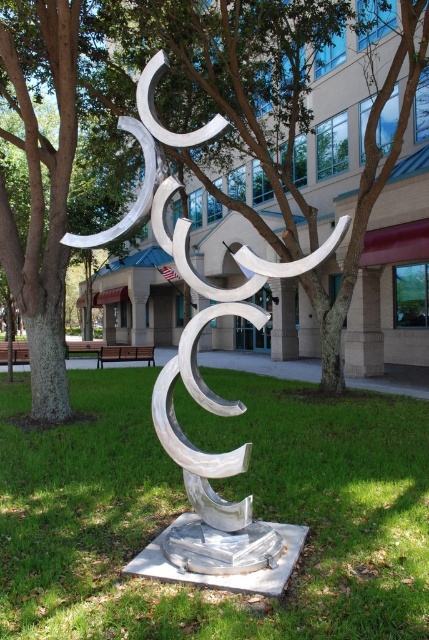
This screenshot has width=429, height=640. What do you see at coordinates (223, 496) in the screenshot?
I see `green grass at center` at bounding box center [223, 496].

Can you confirm if green grass at center is smaller than polished silver sculpture at center?

Yes, green grass at center is smaller than polished silver sculpture at center.

Identify the location of green grass at center. (223, 496).

Where is `green grass at center`? The width and height of the screenshot is (429, 640). green grass at center is located at coordinates (223, 496).

Does polished silver sculpture at center have a greater width compared to wooden park bench at center?

No, polished silver sculpture at center is not wider than wooden park bench at center.

Is point (278, 550) farther from camera compared to point (85, 342)?

No, it is in front of (85, 342).

Where is `polished silver sculpture at center`? The image size is (429, 640). polished silver sculpture at center is located at coordinates (196, 355).

Between green grass at center and wooden bench at center, which one has less height?

With less height is green grass at center.

Is green grass at center thinner than wooden bench at center?

Yes.

Is point (302, 592) behind point (111, 356)?

No, it is not.

Where is `green grass at center`? The image size is (429, 640). green grass at center is located at coordinates (223, 496).